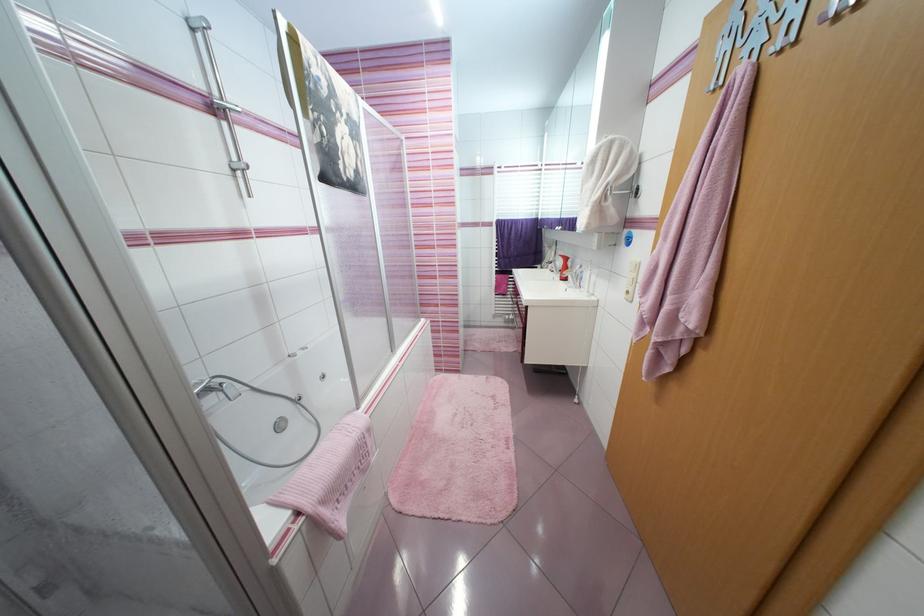
What do you see at coordinates (199, 17) in the screenshot? I see `the shower screen frame` at bounding box center [199, 17].